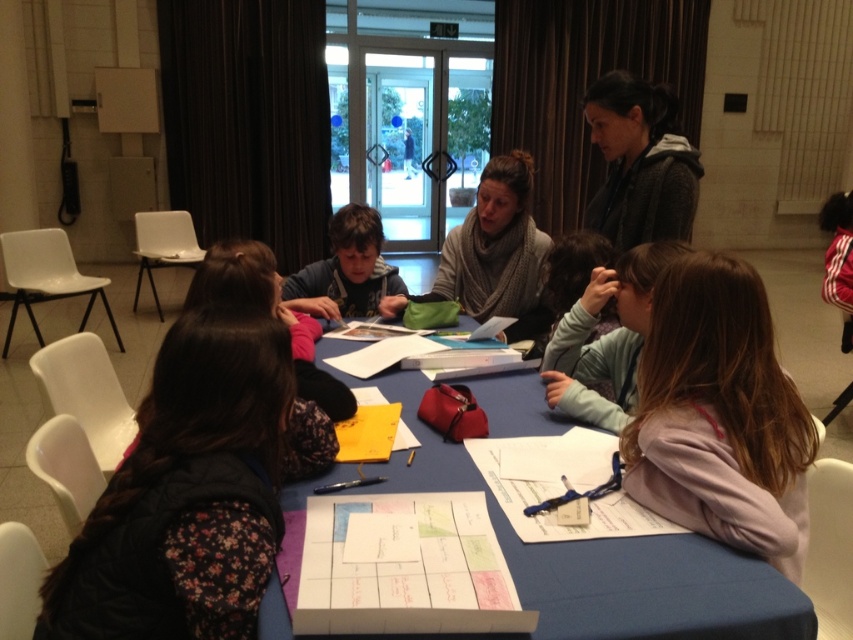
You are a participant in the collaborative activity at the table. You need to place a small object between the knitted scarf at center and the matte blue shirt at center. Which one should you place it closer to if you want it to be near the taller item?

The knitted scarf at center is taller than the matte blue shirt at center, so you should place the small object closer to the knitted scarf at center.

You are a photographer standing to the side of the group. You want to take a photo that includes both the matte blue shirt at center and the blue fabric table at center. Which object should you position closer to the left side of your camera frame to ensure both are visible?

The matte blue shirt at center is positioned on the left side of blue fabric table at center, so you should position the matte blue shirt at center closer to the left side of your camera frame to ensure both are visible.

You are organizing a clothing drive and need to stack jackets vertically. You have two pink fleece jackets available. One is the pink fleece jacket at center and the other is the pink fleece jacket at lower right. Which jacket can you stack higher without folding?

The pink fleece jacket at center can be stacked higher without folding because it has a greater height compared to the pink fleece jacket at lower right.